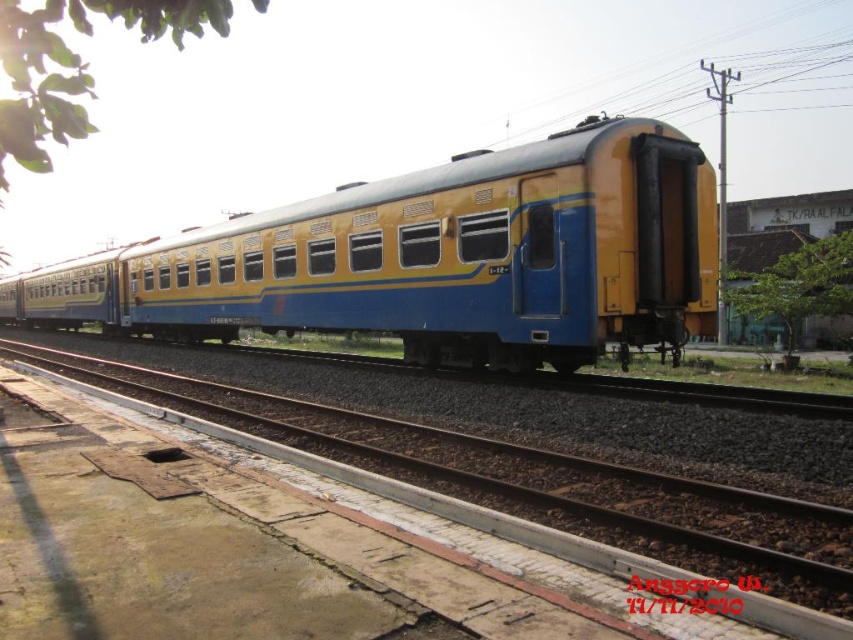
How distant is green leafy tree at upper left from brown gravel track at center?

79.23 meters

Does green leafy tree at upper left have a lesser width compared to brown gravel track at center?

In fact, green leafy tree at upper left might be wider than brown gravel track at center.

Find the location of `green leafy tree at upper left`. green leafy tree at upper left is located at coordinates (74, 65).

Is green leafy tree at upper left shorter than green leafy tree at right?

Incorrect, green leafy tree at upper left's height does not fall short of green leafy tree at right's.

Who is more distant from viewer, (27, 145) or (825, 307)?

Point (825, 307)

Is point (12, 26) more distant than point (784, 323)?

No, it is in front of (784, 323).

Image resolution: width=853 pixels, height=640 pixels. Identify the location of green leafy tree at upper left. (74, 65).

Based on the photo, can you confirm if yellow matte train car at center is positioned below brown gravel track at center?

No.

Does yellow matte train car at center have a lesser height compared to brown gravel track at center?

In fact, yellow matte train car at center may be taller than brown gravel track at center.

Between point (521, 273) and point (552, 572), which one is positioned behind?

The point (521, 273) is more distant.

I want to click on yellow matte train car at center, so click(x=434, y=259).